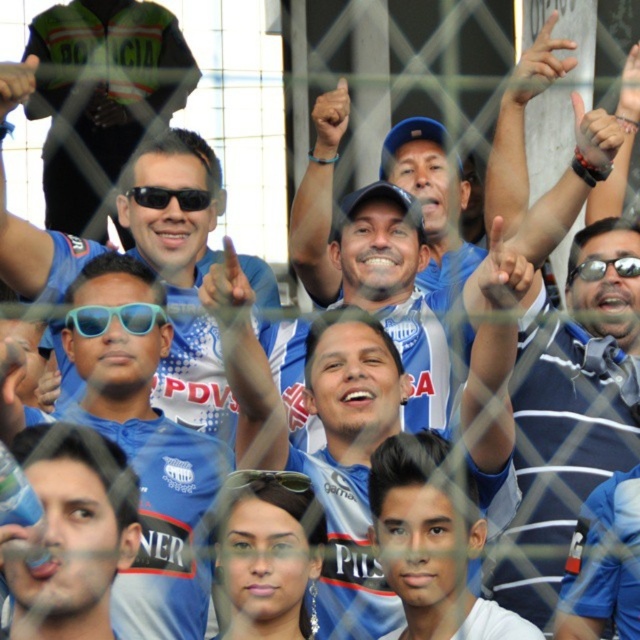
You are a photographer at the soccer match and want to capture a photo that includes both the matte black sunglasses at upper left and the blue fabric shirt at center. Based on their positions, which object should you adjust your camera to focus on first to ensure both are in the frame?

The matte black sunglasses at upper left is to the left of the blue fabric shirt at center. To include both in the frame, focus on the matte black sunglasses at upper left first, then adjust the camera to include the blue fabric shirt at center as it is positioned to the right of the sunglasses.

You are a photographer at the soccer match and want to capture a closeup shot of the matte black sunglasses at upper left and the black plastic sunglasses at center. Which pair of sunglasses is bigger in the photo?

The matte black sunglasses at upper left has a larger size compared to the black plastic sunglasses at center, so the matte black sunglasses at upper left is bigger in the photo.